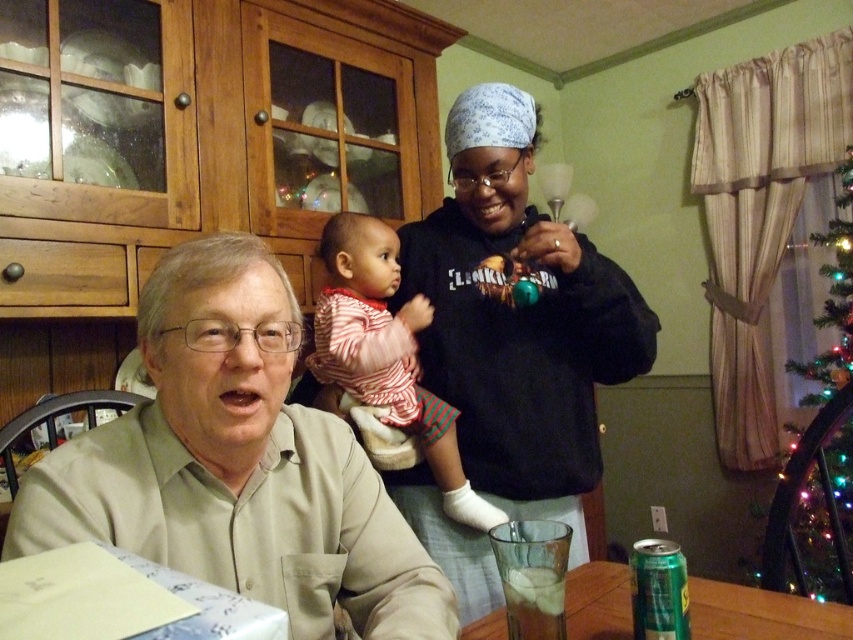
Question: Which point is closer to the camera taking this photo?

Choices:
 (A) (811, 492)
 (B) (380, 339)

Answer: (B)

Question: Which object is closer to the camera taking this photo?

Choices:
 (A) striped cotton onesie at center
 (B) iridescent glass christmas tree at right

Answer: (A)

Question: From the image, what is the correct spatial relationship of black matte sweatshirt at center in relation to iridescent glass christmas tree at right?

Choices:
 (A) below
 (B) above

Answer: (B)

Question: Can you confirm if black matte sweatshirt at center is positioned below striped cotton onesie at center?

Choices:
 (A) no
 (B) yes

Answer: (A)

Question: Which object is positioned closest to the striped cotton onesie at center?

Choices:
 (A) iridescent glass christmas tree at right
 (B) black matte sweatshirt at center
 (C) light beige shirt at lower left

Answer: (B)

Question: Is the position of light beige shirt at lower left more distant than that of black matte sweatshirt at center?

Choices:
 (A) no
 (B) yes

Answer: (A)